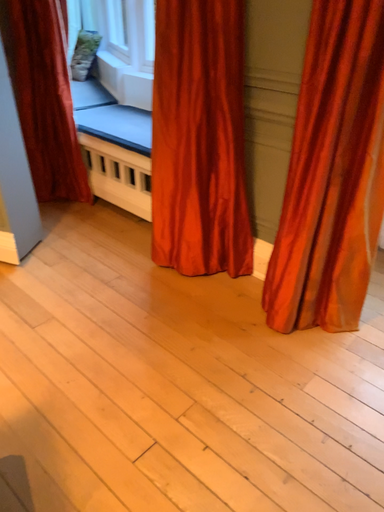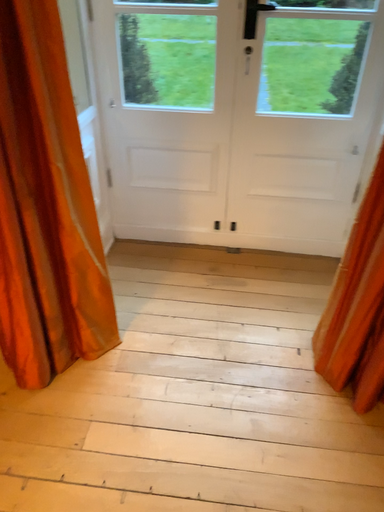
Question: How did the camera likely rotate when shooting the video?

Choices:
 (A) rotated right
 (B) rotated left

Answer: (A)